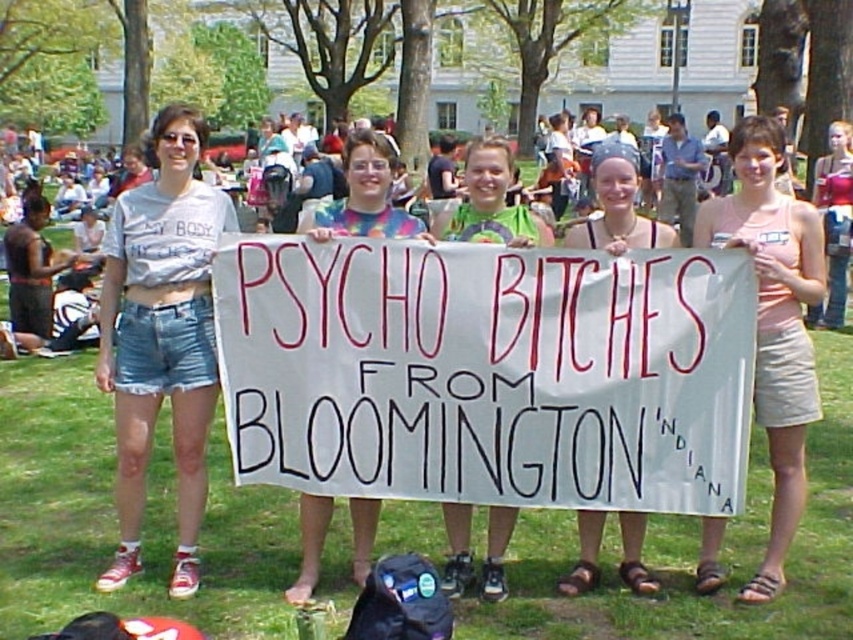
Is point (102, 582) more distant than point (802, 506)?

That is False.

Is point (161, 275) positioned after point (805, 420)?

No.

Locate an element on the screen. denim shorts at left is located at coordinates (161, 337).

Can you confirm if green jersey at center is shorter than matte white sign at center?

Yes.

This screenshot has width=853, height=640. Find the location of `green jersey at center`. green jersey at center is located at coordinates (490, 202).

Between point (492, 189) and point (624, 214), which one is positioned in front?

Point (492, 189)

The image size is (853, 640). Find the location of `green jersey at center`. green jersey at center is located at coordinates (490, 202).

Does multicolored tie-dye shirt at center come in front of matte white sign at center?

No, it is behind matte white sign at center.

Does multicolored tie-dye shirt at center appear on the right side of matte white sign at center?

Incorrect, multicolored tie-dye shirt at center is not on the right side of matte white sign at center.

Does point (308, 513) come behind point (590, 232)?

No.

The width and height of the screenshot is (853, 640). In order to click on multicolored tie-dye shirt at center in this screenshot , I will do `click(364, 195)`.